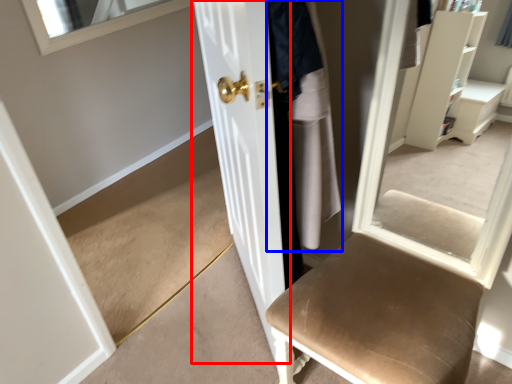
Question: Which object is closer to the camera taking this photo, door (highlighted by a red box) or clothing (highlighted by a blue box)?

Choices:
 (A) door
 (B) clothing

Answer: (A)